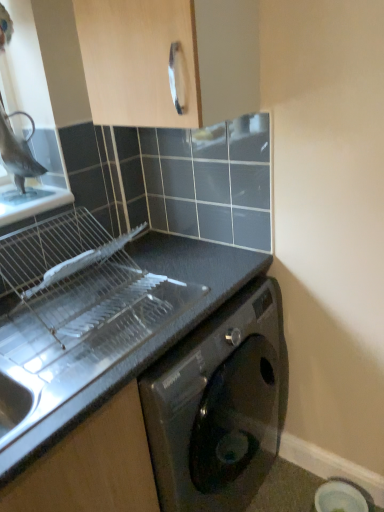
This screenshot has height=512, width=384. I want to click on light wood cabinet handle at upper center, so click(167, 59).

The height and width of the screenshot is (512, 384). I want to click on matte black washing machine at lower right, so click(342, 497).

I want to click on black matte countertop at lower left, so click(151, 336).

Measure the distance from matte black washing machine at lower right to light wood cabinet handle at upper center.

They are 1.54 meters apart.

In the scene shown: Is matte black washing machine at lower right positioned far away from light wood cabinet handle at upper center?

Yes, matte black washing machine at lower right and light wood cabinet handle at upper center are located far from each other.

Identify the location of appliance that appears behind the light wood cabinet handle at upper center. The image size is (384, 512). (342, 497).

From the image's perspective, which one is positioned lower, matte black washing machine at lower right or light wood cabinet handle at upper center?

matte black washing machine at lower right is shown below in the image.

Looking at their sizes, would you say light wood cabinet handle at upper center is wider or thinner than black matte countertop at lower left?

In the image, light wood cabinet handle at upper center appears to be more narrow than black matte countertop at lower left.

From a real-world perspective, is light wood cabinet handle at upper center positioned above or below black matte countertop at lower left?

light wood cabinet handle at upper center is situated higher than black matte countertop at lower left in the real world.

Looking at the image, does light wood cabinet handle at upper center seem bigger or smaller compared to black matte countertop at lower left?

Clearly, light wood cabinet handle at upper center is smaller in size than black matte countertop at lower left.

From a real-world perspective, is black matte countertop at lower left on top of light wood cabinet handle at upper center?

No, from a real-world perspective, black matte countertop at lower left is not on top of light wood cabinet handle at upper center.

In the scene shown: Is black matte countertop at lower left to the right of light wood cabinet handle at upper center from the viewer's perspective?

No.

Locate an element on the screen. countertop located underneath the light wood cabinet handle at upper center (from a real-world perspective) is located at coordinates click(151, 336).

Would you consider black matte countertop at lower left to be distant from light wood cabinet handle at upper center?

That's not correct — black matte countertop at lower left is a little close to light wood cabinet handle at upper center.

Can you confirm if matte black washing machine at lower right is positioned to the right of black matte countertop at lower left?

Yes.

From the image's perspective, relative to black matte countertop at lower left, is matte black washing machine at lower right above or below?

From the image's perspective, matte black washing machine at lower right appears below black matte countertop at lower left.

How different are the orientations of matte black washing machine at lower right and black matte countertop at lower left in degrees?

90 degrees.

Based on the photo, which object is closer to the camera, matte black washing machine at lower right or black matte countertop at lower left?

black matte countertop at lower left is in front.

In the scene shown: Is black matte countertop at lower left positioned with its back to matte black washing machine at lower right?

black matte countertop at lower left does not have its back to matte black washing machine at lower right.

Is black matte countertop at lower left inside or outside of matte black washing machine at lower right?

black matte countertop at lower left exists outside the volume of matte black washing machine at lower right.

Is black matte countertop at lower left not close to matte black washing machine at lower right?

No, black matte countertop at lower left is not far away from matte black washing machine at lower right.

Is black matte countertop at lower left wider or thinner than matte black washing machine at lower right?

Considering their sizes, black matte countertop at lower left looks broader than matte black washing machine at lower right.

Looking at this image, is matte black washing machine at lower right surrounded by light wood cabinet handle at upper center?

No, matte black washing machine at lower right is not surrounded by light wood cabinet handle at upper center.

Could you tell me if light wood cabinet handle at upper center is turned towards matte black washing machine at lower right?

No, light wood cabinet handle at upper center is not facing towards matte black washing machine at lower right.

Is light wood cabinet handle at upper center at the right side of matte black washing machine at lower right?

No, light wood cabinet handle at upper center is not to the right of matte black washing machine at lower right.

Between light wood cabinet handle at upper center and matte black washing machine at lower right, which one has smaller width?

matte black washing machine at lower right is thinner.

Identify the location of appliance that is under the light wood cabinet handle at upper center (from a real-world perspective). This screenshot has width=384, height=512. (342, 497).

Identify the location of countertop that is below the light wood cabinet handle at upper center (from the image's perspective). This screenshot has height=512, width=384. (151, 336).

Based on their spatial positions, is black matte countertop at lower left or matte black washing machine at lower right further from light wood cabinet handle at upper center?

The object further to light wood cabinet handle at upper center is matte black washing machine at lower right.

From the image, which object appears to be farther from matte black washing machine at lower right, black matte countertop at lower left or light wood cabinet handle at upper center?

light wood cabinet handle at upper center.

Considering their positions, is light wood cabinet handle at upper center positioned further to black matte countertop at lower left than matte black washing machine at lower right?

matte black washing machine at lower right.

Looking at the image, which one is located further to light wood cabinet handle at upper center, matte black washing machine at lower right or black matte countertop at lower left?

matte black washing machine at lower right lies further to light wood cabinet handle at upper center than the other object.

In the scene shown: Considering their positions, is matte black washing machine at lower right positioned closer to black matte countertop at lower left than light wood cabinet handle at upper center?

light wood cabinet handle at upper center.

From the image, which object appears to be farther from matte black washing machine at lower right, light wood cabinet handle at upper center or black matte countertop at lower left?

The object further to matte black washing machine at lower right is light wood cabinet handle at upper center.

What are the coordinates of `countertop between light wood cabinet handle at upper center and matte black washing machine at lower right in the up-down direction` in the screenshot? It's located at (151, 336).